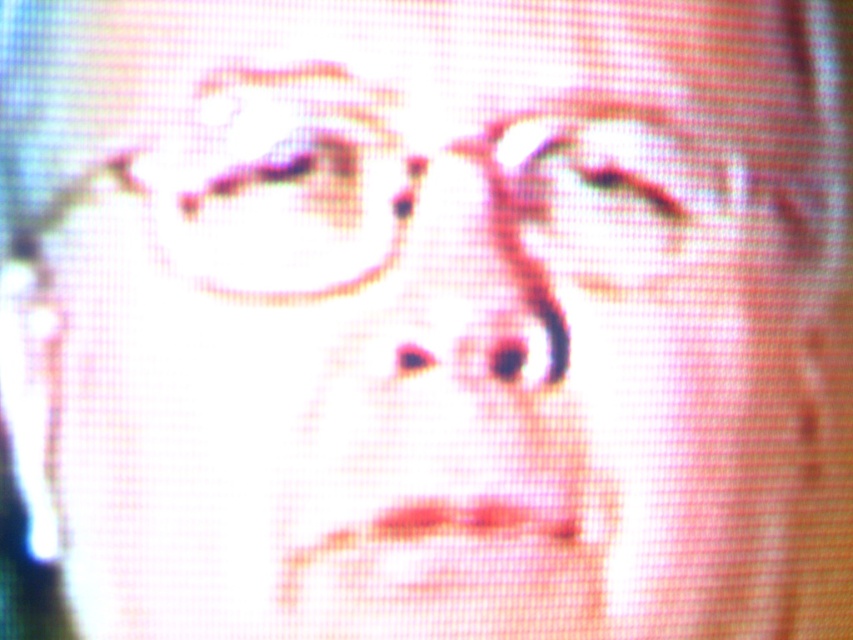
Locate an element on the screen. matte plastic glasses at center is located at coordinates (418, 216).

Is point (456, 173) positioned in front of point (310, 72)?

That is False.

Where is `matte plastic glasses at center`? This screenshot has width=853, height=640. matte plastic glasses at center is located at coordinates (418, 216).